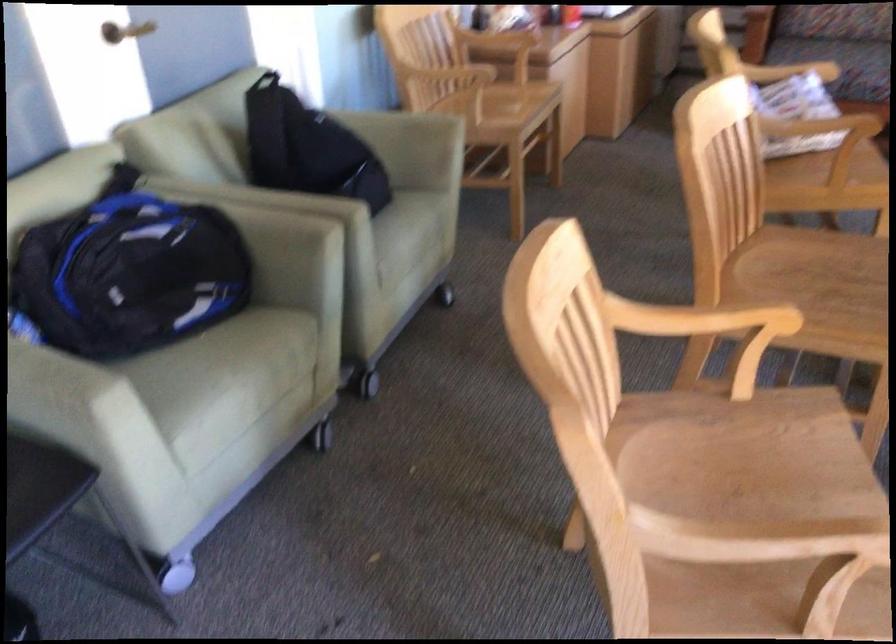
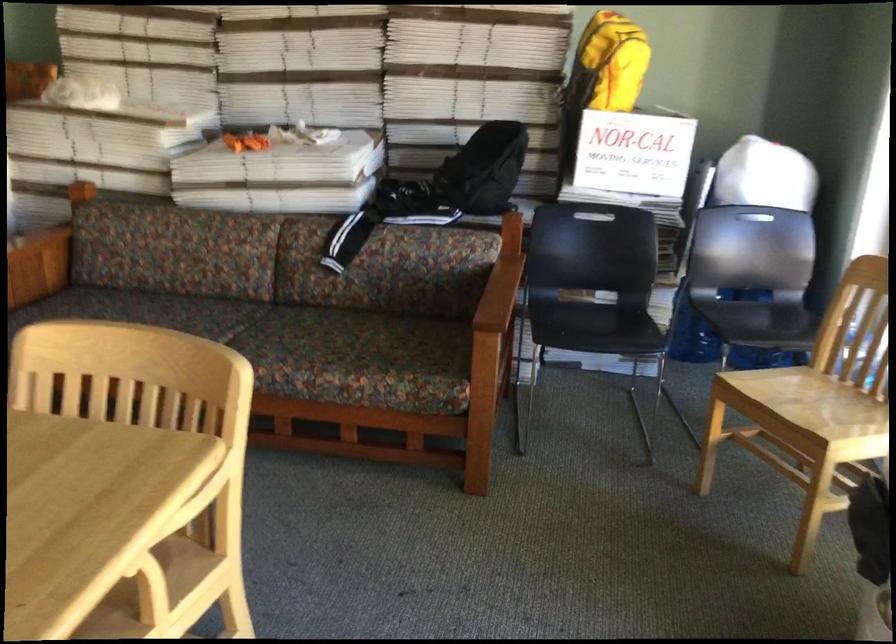
Question: The images are taken continuously from a first-person perspective. In which direction are you moving?

Choices:
 (A) Left
 (B) Right
 (C) Forward
 (D) Backward

Answer: (B)